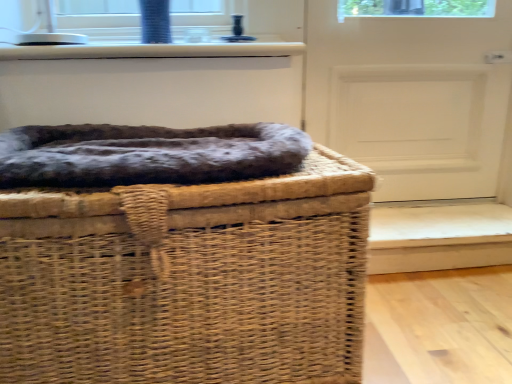
Question: Does woven brown basket at center have a larger size compared to white glossy window sill at upper center?

Choices:
 (A) yes
 (B) no

Answer: (A)

Question: Is woven brown basket at center to the right of white glossy window sill at upper center from the viewer's perspective?

Choices:
 (A) no
 (B) yes

Answer: (B)

Question: Does woven brown basket at center have a greater height compared to white glossy window sill at upper center?

Choices:
 (A) yes
 (B) no

Answer: (A)

Question: Is woven brown basket at center far from white glossy window sill at upper center?

Choices:
 (A) no
 (B) yes

Answer: (A)

Question: Does woven brown basket at center have a smaller size compared to white glossy window sill at upper center?

Choices:
 (A) no
 (B) yes

Answer: (A)

Question: Relative to woven brown basket at center, is white matte door at center in front or behind?

Choices:
 (A) front
 (B) behind

Answer: (B)

Question: Would you say white matte door at center is to the left or to the right of woven brown basket at center in the picture?

Choices:
 (A) right
 (B) left

Answer: (A)

Question: Is white matte door at center spatially inside woven brown basket at center, or outside of it?

Choices:
 (A) inside
 (B) outside

Answer: (B)

Question: From their relative heights in the image, would you say white matte door at center is taller or shorter than woven brown basket at center?

Choices:
 (A) short
 (B) tall

Answer: (B)

Question: Looking at their shapes, would you say white matte door at center is wider or thinner than white glossy window sill at upper center?

Choices:
 (A) thin
 (B) wide

Answer: (A)

Question: Does point (484, 150) appear closer or farther from the camera than point (95, 54)?

Choices:
 (A) farther
 (B) closer

Answer: (A)

Question: Do you think white matte door at center is within white glossy window sill at upper center, or outside of it?

Choices:
 (A) outside
 (B) inside

Answer: (A)

Question: Considering the positions of white matte door at center and white glossy window sill at upper center in the image, is white matte door at center taller or shorter than white glossy window sill at upper center?

Choices:
 (A) tall
 (B) short

Answer: (A)

Question: Is woven brown basket at center spatially inside white matte door at center, or outside of it?

Choices:
 (A) inside
 (B) outside

Answer: (B)

Question: Does point (183, 362) appear closer or farther from the camera than point (484, 34)?

Choices:
 (A) farther
 (B) closer

Answer: (B)